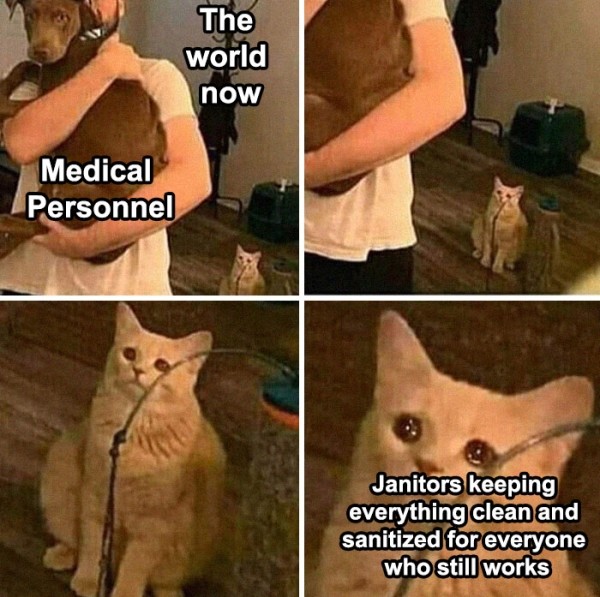
Where is `black and orange shower head`? The width and height of the screenshot is (600, 597). black and orange shower head is located at coordinates (546, 208), (280, 267), (286, 402).